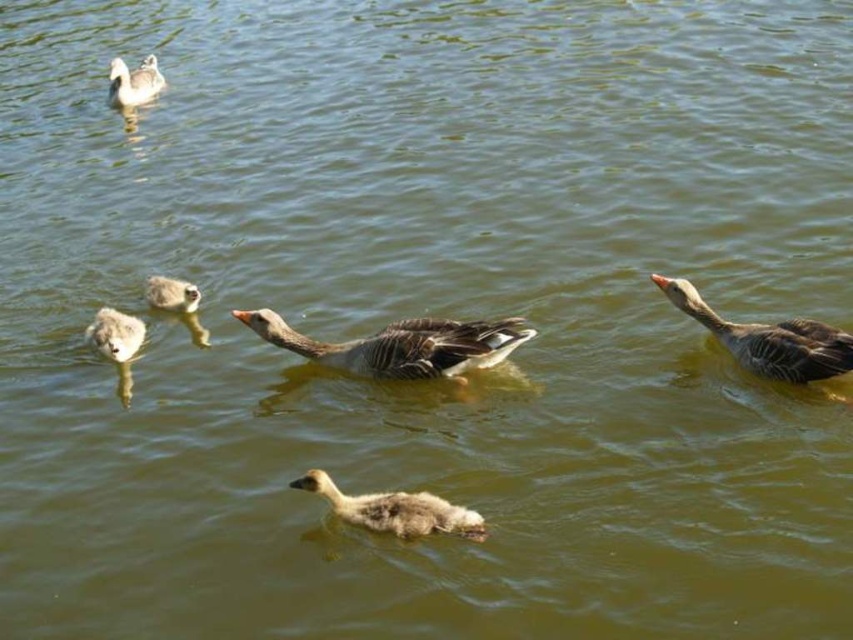
You are a photographer standing on the bank of the pond. You want to take a photo of the gray matte duck at right and the gray matte duckling at upper left. Which one will appear higher in the photo?

The gray matte duckling at upper left will appear higher in the photo because it is located above the gray matte duck at right.